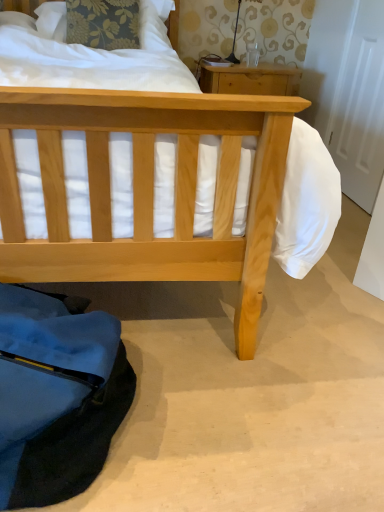
Question: Choose the correct answer: Is matte black lamp at upper center inside floral fabric pillow at upper left or outside it?

Choices:
 (A) inside
 (B) outside

Answer: (B)

Question: Does point (233, 40) appear closer or farther from the camera than point (59, 2)?

Choices:
 (A) farther
 (B) closer

Answer: (A)

Question: Which object is positioned farthest from the natural wood nightstand at upper center?

Choices:
 (A) floral fabric pillow at upper left
 (B) matte black lamp at upper center

Answer: (A)

Question: Estimate the real-world distances between objects in this image. Which object is closer to the matte black lamp at upper center?

Choices:
 (A) floral fabric pillow at upper left
 (B) natural wood nightstand at upper center

Answer: (B)